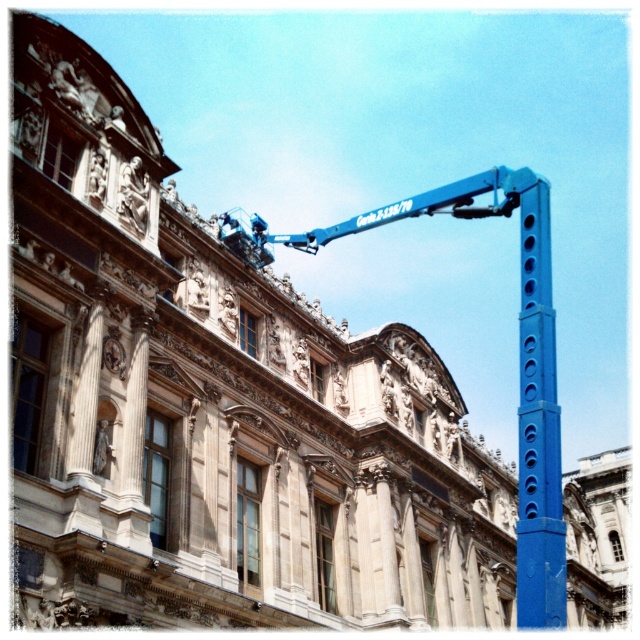
You are an architect inspecting the construction site of the classical building. You notice the blue metallic crane at upper center and the blue metallic pole at right. Which object is bigger in size?

The blue metallic crane at upper center is larger in size compared to the blue metallic pole at right according to the description.

You are a construction worker standing at the base of the blue metallic pole at right. You need to attach a safety harness to the closest point on the blue metallic crane at upper center. Can you reach it without moving from your current position?

The blue metallic crane at upper center is 8.16 meters away from the blue metallic pole at right. Since the distance is too far to reach without moving, you cannot attach the safety harness from your current position.

You are an architect examining the building facade. The blue metallic crane at upper center has a bucket attached to its arm. If the crane needs to lower the bucket to the ground level, which is at point y coordinate 0.0, will the bucket be able to reach the ground without moving the crane itself?

The blue metallic crane at upper center is located at point y coordinate 0.811. Since the ground level is at y coordinate 0.0, the crane can lower the bucket vertically downward to reach the ground without moving the crane itself.